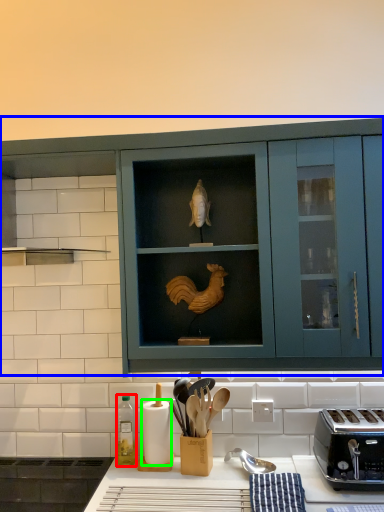
Question: Which is nearer to the bottle (highlighted by a red box)? cabinetry (highlighted by a blue box) or paper towel (highlighted by a green box).

Choices:
 (A) cabinetry
 (B) paper towel

Answer: (B)